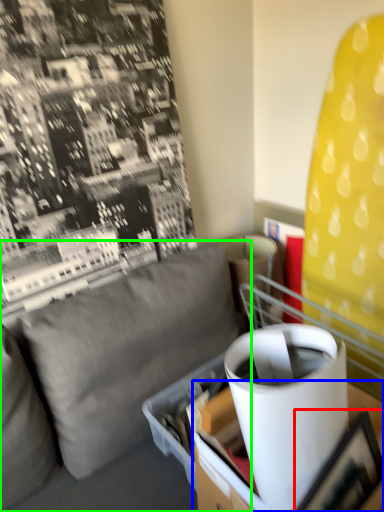
Question: Based on their relative distances, which object is farther from picture frame (highlighted by a red box)? Choose from table (highlighted by a blue box) and studio couch (highlighted by a green box).

Choices:
 (A) table
 (B) studio couch

Answer: (B)